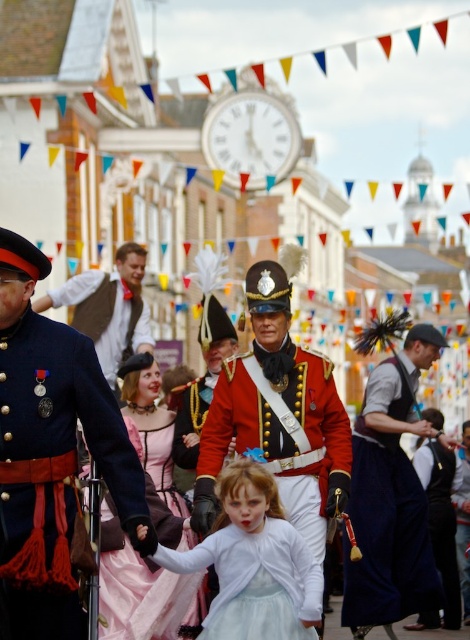
Question: Can you confirm if dark blue velvet vest at center is smaller than velvet black vest at lower right?

Choices:
 (A) yes
 (B) no

Answer: (B)

Question: Among these points, which one is nearest to the camera?

Choices:
 (A) (107, 570)
 (B) (61, 624)
 (C) (361, 621)

Answer: (B)

Question: Which object appears closest to the camera in this image?

Choices:
 (A) shiny red uniform at center
 (B) matte brown vest at center

Answer: (A)

Question: Is white satin dress at center bigger than pink satin dress at center?

Choices:
 (A) yes
 (B) no

Answer: (B)

Question: Which point is closer to the camera?

Choices:
 (A) pink satin dress at center
 (B) shiny gold uniform at center
 (C) matte brown vest at center
 (D) dark blue velvet vest at center

Answer: (B)

Question: Does shiny red uniform at center have a greater width compared to matte brown vest at center?

Choices:
 (A) yes
 (B) no

Answer: (A)